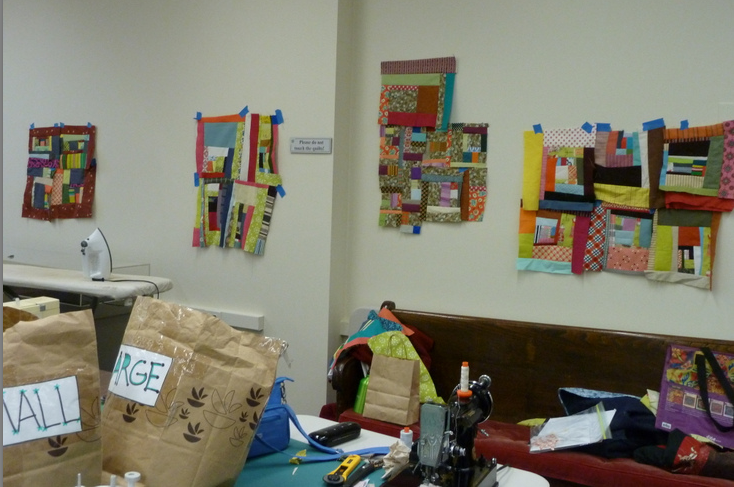
This screenshot has height=487, width=734. What are the coordinates of `hanging artwork` in the screenshot? It's located at (614, 201), (412, 170), (250, 169), (61, 167).